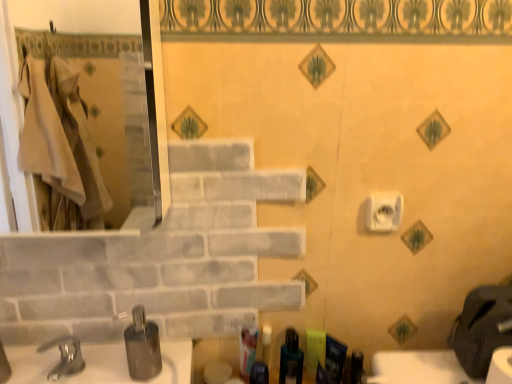
Question: Does metallic silver soap dispenser at lower left lie in front of translucent plastic toothbrush at lower center, the third toiletry positioned from the right?

Choices:
 (A) yes
 (B) no

Answer: (A)

Question: Can you confirm if metallic silver soap dispenser at lower left is positioned to the right of translucent plastic toothbrush at lower center, the third toiletry positioned from the right?

Choices:
 (A) no
 (B) yes

Answer: (A)

Question: From a real-world perspective, is metallic silver soap dispenser at lower left over translucent plastic toothbrush at lower center, the third toiletry positioned from the right?

Choices:
 (A) yes
 (B) no

Answer: (A)

Question: From the image's perspective, is metallic silver soap dispenser at lower left located beneath translucent plastic toothbrush at lower center, the third toiletry positioned from the right?

Choices:
 (A) no
 (B) yes

Answer: (A)

Question: Is metallic silver soap dispenser at lower left not within translucent plastic toothbrush at lower center, the third toiletry positioned from the right?

Choices:
 (A) yes
 (B) no

Answer: (A)

Question: Considering the relative sizes of metallic silver soap dispenser at lower left and translucent plastic toothbrush at lower center, the third toiletry positioned from the right, in the image provided, is metallic silver soap dispenser at lower left bigger than translucent plastic toothbrush at lower center, the third toiletry positioned from the right,?

Choices:
 (A) no
 (B) yes

Answer: (B)

Question: From the image's perspective, is blue matte toothpaste tube at lower right, which is the 6th toiletry in left-to-right order, on top of white matte toilet paper at center right?

Choices:
 (A) yes
 (B) no

Answer: (B)

Question: Considering the relative positions of blue matte toothpaste tube at lower right, which is the 6th toiletry in left-to-right order, and white matte toilet paper at center right in the image provided, is blue matte toothpaste tube at lower right, which is the 6th toiletry in left-to-right order, to the right of white matte toilet paper at center right from the viewer's perspective?

Choices:
 (A) yes
 (B) no

Answer: (B)

Question: Is blue matte toothpaste tube at lower right, which is the 6th toiletry in left-to-right order, facing towards white matte toilet paper at center right?

Choices:
 (A) no
 (B) yes

Answer: (A)

Question: Would you say blue matte toothpaste tube at lower right, which is the 1th toiletry from right to left, is outside white matte toilet paper at center right?

Choices:
 (A) no
 (B) yes

Answer: (B)

Question: From a real-world perspective, is blue matte toothpaste tube at lower right, which is the 1th toiletry from right to left, located beneath white matte toilet paper at center right?

Choices:
 (A) no
 (B) yes

Answer: (B)

Question: From a real-world perspective, is blue matte toothpaste tube at lower right, which is the 1th toiletry from right to left, over white matte toilet paper at center right?

Choices:
 (A) yes
 (B) no

Answer: (B)

Question: From a real-world perspective, is translucent plastic toothbrush at lower center, the third toiletry positioned from the right, beneath blue matte toothpaste tube at lower right, which is the 6th toiletry in left-to-right order?

Choices:
 (A) no
 (B) yes

Answer: (B)